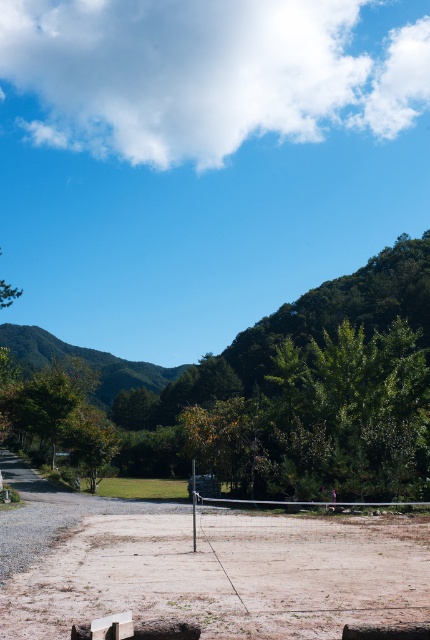
Question: Which point is farther to the camera?

Choices:
 (A) click(331, 628)
 (B) click(229, 451)

Answer: (B)

Question: Which point is farther to the camera?

Choices:
 (A) green leafy tree at center
 (B) brown sandy dirt field at center

Answer: (A)

Question: Does green leafy tree at center have a greater width compared to brown sandy dirt field at center?

Choices:
 (A) no
 (B) yes

Answer: (B)

Question: Does green leafy tree at center appear on the left side of brown sandy dirt field at center?

Choices:
 (A) yes
 (B) no

Answer: (B)

Question: Can you confirm if green leafy tree at center is positioned to the left of brown sandy dirt field at center?

Choices:
 (A) no
 (B) yes

Answer: (A)

Question: Among these points, which one is farthest from the camera?

Choices:
 (A) (393, 442)
 (B) (242, 595)

Answer: (A)